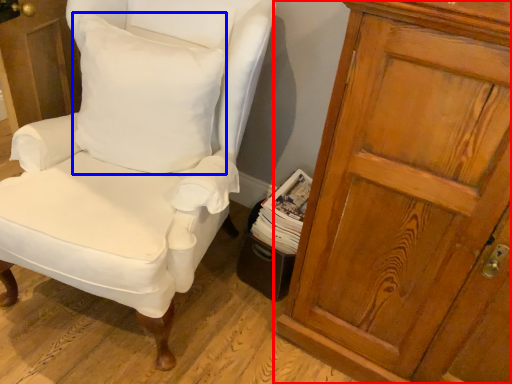
Question: Which point is closer to the camera, cupboard (highlighted by a red box) or pillow (highlighted by a blue box)?

Choices:
 (A) cupboard
 (B) pillow

Answer: (A)